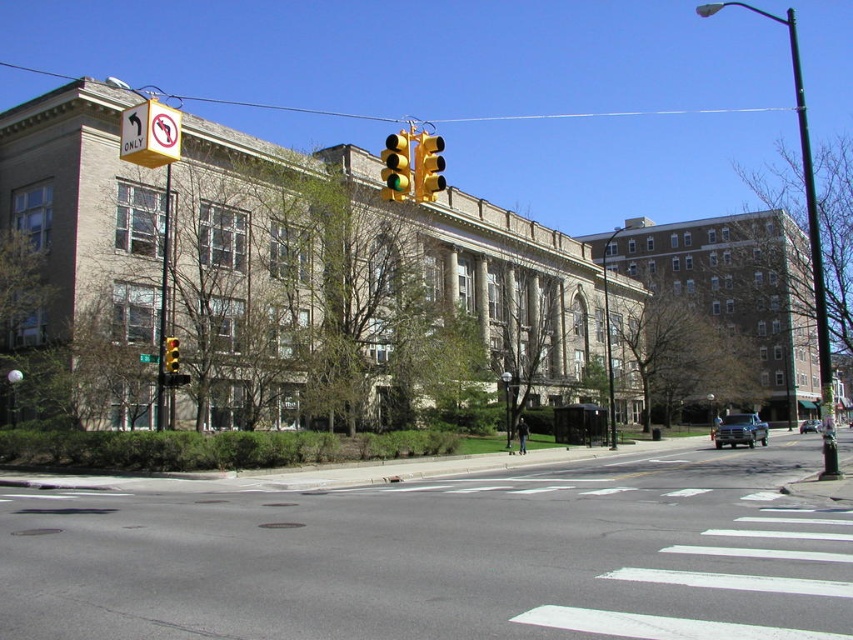
Describe the element at coordinates (395, 166) in the screenshot. This screenshot has width=853, height=640. I see `yellow glass traffic light at center` at that location.

Does point (396, 148) come closer to viewer compared to point (143, 360)?

Yes, it is.

From the picture: Who is more distant from viewer, (397, 160) or (155, 362)?

The point (155, 362) is behind.

At what (x,y) coordinates should I click in order to perform the action: click on yellow glass traffic light at center. Please return your answer as a coordinate pair (x, y). The width and height of the screenshot is (853, 640). Looking at the image, I should click on (395, 166).

Is metallic silver truck at right closer to camera compared to yellow plastic traffic light at center?

No, metallic silver truck at right is behind yellow plastic traffic light at center.

Is point (729, 417) positioned before point (177, 355)?

No, (729, 417) is behind (177, 355).

Find the location of a particular element. Image resolution: width=853 pixels, height=640 pixels. metallic silver truck at right is located at coordinates (740, 429).

Identify the location of yellow metallic traffic light at center. The image size is (853, 640). (427, 166).

Where is `yellow metallic traffic light at center`? yellow metallic traffic light at center is located at coordinates (427, 166).